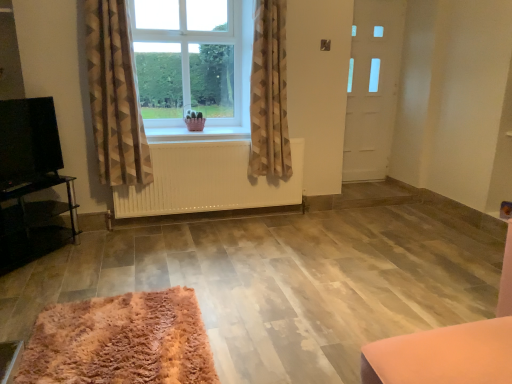
Question: Considering the relative sizes of clear glass window at center and fluffy pink rug at lower left in the image provided, is clear glass window at center shorter than fluffy pink rug at lower left?

Choices:
 (A) yes
 (B) no

Answer: (B)

Question: Is clear glass window at center in front of fluffy pink rug at lower left?

Choices:
 (A) yes
 (B) no

Answer: (B)

Question: Is clear glass window at center not close to fluffy pink rug at lower left?

Choices:
 (A) yes
 (B) no

Answer: (A)

Question: Does clear glass window at center appear on the left side of fluffy pink rug at lower left?

Choices:
 (A) yes
 (B) no

Answer: (B)

Question: Does clear glass window at center have a greater width compared to fluffy pink rug at lower left?

Choices:
 (A) no
 (B) yes

Answer: (A)

Question: Is white matte door at right taller or shorter than beige textured curtain at center, the 2th curtain from the left?

Choices:
 (A) short
 (B) tall

Answer: (B)

Question: Considering their positions, is white matte door at right located in front of or behind beige textured curtain at center, the 2th curtain from the left?

Choices:
 (A) behind
 (B) front

Answer: (A)

Question: In terms of width, does white matte door at right look wider or thinner when compared to beige textured curtain at center, the 2th curtain from the left?

Choices:
 (A) wide
 (B) thin

Answer: (B)

Question: From a real-world perspective, is white matte door at right above or below beige textured curtain at center, placed as the first curtain when sorted from right to left?

Choices:
 (A) below
 (B) above

Answer: (A)

Question: Looking at their shapes, would you say clear glass window at center is wider or thinner than black glossy tv at left?

Choices:
 (A) wide
 (B) thin

Answer: (A)

Question: Is clear glass window at center bigger or smaller than black glossy tv at left?

Choices:
 (A) big
 (B) small

Answer: (A)

Question: Visually, is clear glass window at center positioned to the left or to the right of black glossy tv at left?

Choices:
 (A) right
 (B) left

Answer: (A)

Question: From the image's perspective, is clear glass window at center positioned above or below black glossy tv at left?

Choices:
 (A) above
 (B) below

Answer: (A)

Question: Would you say white matte door at right is to the left or to the right of white wooden window sill at center in the picture?

Choices:
 (A) right
 (B) left

Answer: (A)

Question: Does point (380, 21) appear closer or farther from the camera than point (215, 117)?

Choices:
 (A) farther
 (B) closer

Answer: (A)